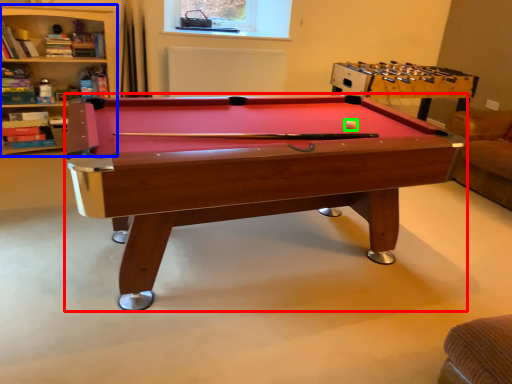
Question: Which object is positioned closest to billiard table (highlighted by a red box)? Select from bookshelf (highlighted by a blue box) and ball (highlighted by a green box).

Choices:
 (A) bookshelf
 (B) ball

Answer: (B)